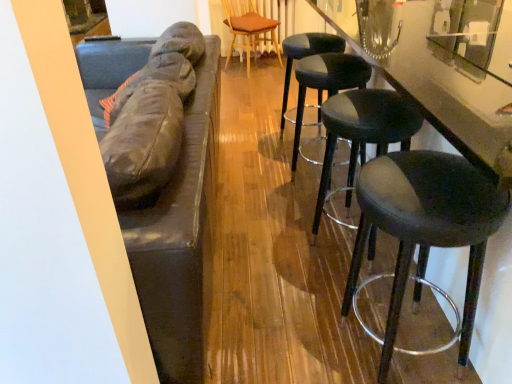
Question: From a real-world perspective, is matte black stool at right, the second stool in the front-to-back sequence, physically above wooden textured chair at center?

Choices:
 (A) yes
 (B) no

Answer: (B)

Question: Does matte black stool at right, which is the third stool from back to front, appear on the right side of wooden textured chair at center?

Choices:
 (A) no
 (B) yes

Answer: (B)

Question: Is matte black stool at right, which is the third stool from back to front, facing towards wooden textured chair at center?

Choices:
 (A) yes
 (B) no

Answer: (B)

Question: Is matte black stool at right, which is the third stool from back to front, turned away from wooden textured chair at center?

Choices:
 (A) yes
 (B) no

Answer: (B)

Question: From the image's perspective, is matte black stool at right, the second stool in the front-to-back sequence, over wooden textured chair at center?

Choices:
 (A) yes
 (B) no

Answer: (B)

Question: Is matte black stool at right, the second stool in the front-to-back sequence, thinner than wooden textured chair at center?

Choices:
 (A) yes
 (B) no

Answer: (A)

Question: Is glossy black counter at right turned away from matte black stool at right, which is the third stool from back to front?

Choices:
 (A) no
 (B) yes

Answer: (B)

Question: Considering the relative positions of glossy black counter at right and matte black stool at right, the second stool in the front-to-back sequence, in the image provided, is glossy black counter at right to the right of matte black stool at right, the second stool in the front-to-back sequence, from the viewer's perspective?

Choices:
 (A) yes
 (B) no

Answer: (A)

Question: Is glossy black counter at right aimed at matte black stool at right, the second stool in the front-to-back sequence?

Choices:
 (A) no
 (B) yes

Answer: (B)

Question: Does glossy black counter at right come behind matte black stool at right, the second stool in the front-to-back sequence?

Choices:
 (A) no
 (B) yes

Answer: (A)

Question: Does glossy black counter at right have a smaller size compared to matte black stool at right, the second stool in the front-to-back sequence?

Choices:
 (A) yes
 (B) no

Answer: (B)

Question: From the image's perspective, is glossy black counter at right over matte black stool at right, the second stool in the front-to-back sequence?

Choices:
 (A) yes
 (B) no

Answer: (A)

Question: Is black leather stool at center, the 4th stool when ordered from front to back, not near black leather stool at right, which is the third stool from front to back?

Choices:
 (A) yes
 (B) no

Answer: (B)